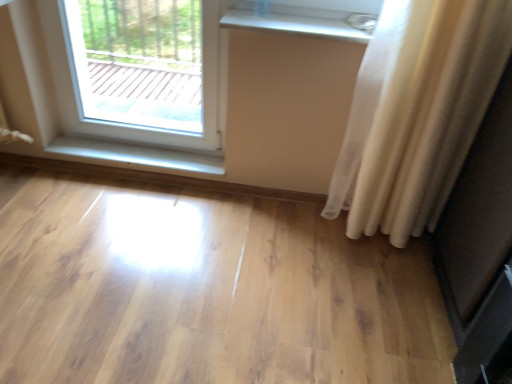
Image resolution: width=512 pixels, height=384 pixels. I want to click on free spot above white glossy radiator at upper center, the first window sill positioned from the front (from a real-world perspective), so click(306, 20).